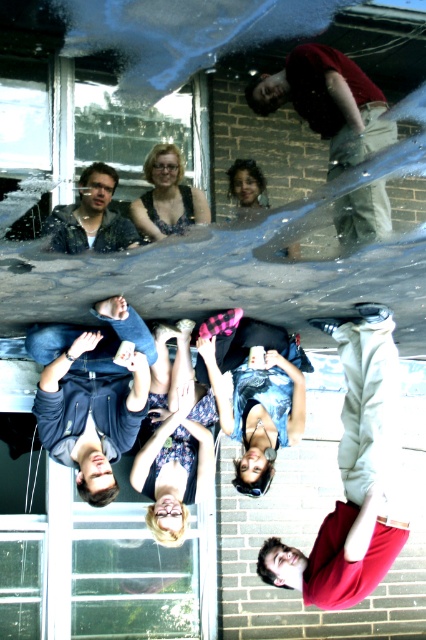
Question: Does red cotton shirt at upper center have a larger size compared to denim shorts at center?

Choices:
 (A) yes
 (B) no

Answer: (A)

Question: Based on their relative distances, which object is nearer to the light gray hoodie at lower right?

Choices:
 (A) smooth skin face at center
 (B) red cotton shirt at upper center
 (C) matte black dress at center
 (D) floral dress at center

Answer: (D)

Question: Which point appears closest to the camera in this image?

Choices:
 (A) (60, 353)
 (B) (62, 212)

Answer: (A)

Question: Does red cotton shirt at upper center have a greater width compared to matte black dress at center?

Choices:
 (A) yes
 (B) no

Answer: (A)

Question: Does matte black jacket at upper left appear over matte black dress at center?

Choices:
 (A) no
 (B) yes

Answer: (A)

Question: Which point appears closest to the camera in this image?

Choices:
 (A) (180, 531)
 (B) (88, 216)
 (C) (193, 204)

Answer: (A)